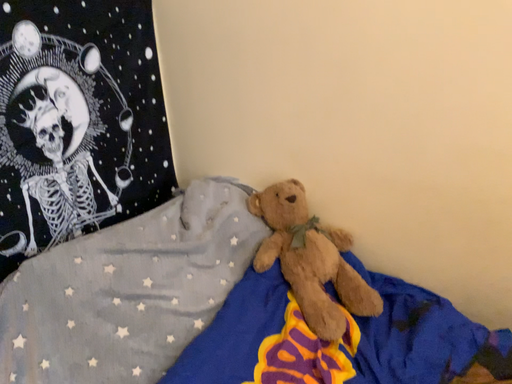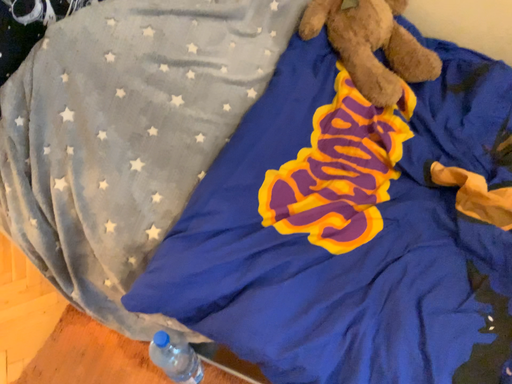
Question: How did the camera likely rotate when shooting the video?

Choices:
 (A) rotated downward
 (B) rotated upward

Answer: (A)